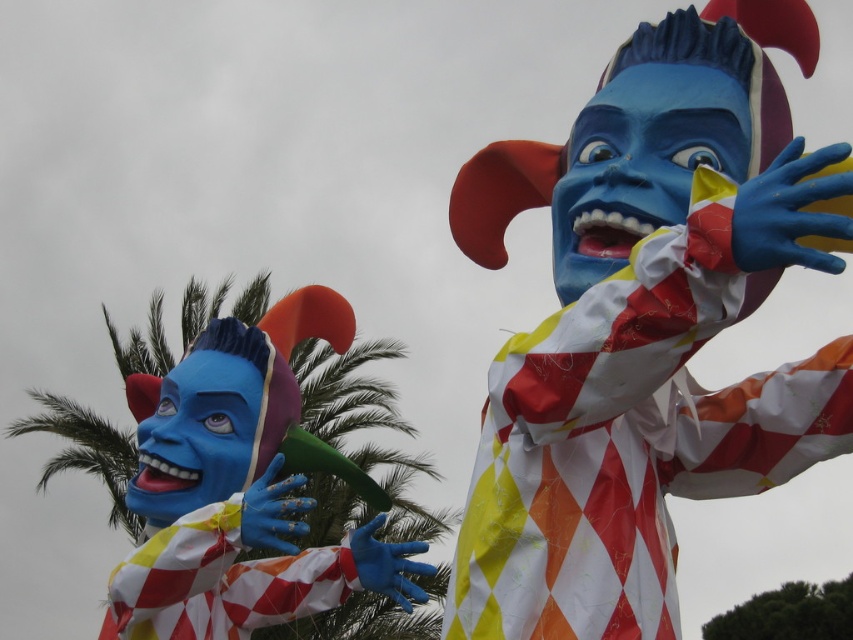
Does harlequin costume at center appear over matte paper clown at left?

Indeed, harlequin costume at center is positioned over matte paper clown at left.

Does harlequin costume at center have a greater width compared to matte paper clown at left?

Yes.

Who is more distant from viewer, (677, 260) or (148, 472)?

The point (148, 472) is behind.

Where is `harlequin costume at center`? The height and width of the screenshot is (640, 853). harlequin costume at center is located at coordinates (645, 326).